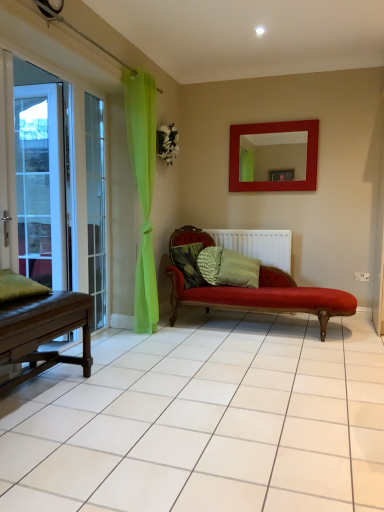
Where is `blank space situated above white matte radiator at center (from a real-world perspective)`? The image size is (384, 512). blank space situated above white matte radiator at center (from a real-world perspective) is located at coordinates (250, 225).